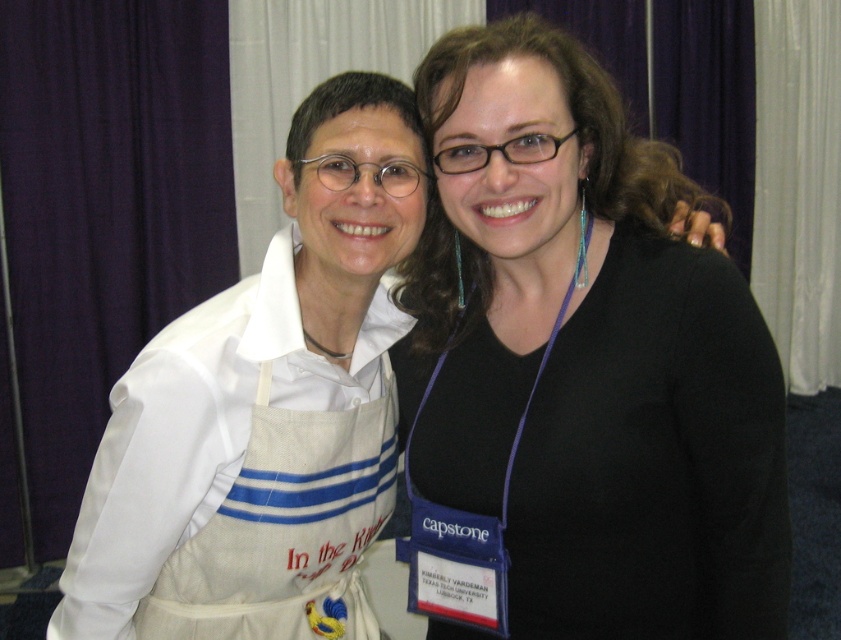
You are a photographer setting up a shot. You have two subjects in front of you. The first is wearing a black matte shirt at center, and the second is wearing a white fabric apron at left. You need to decide which subject to place closer to the camera to ensure their clothing items are clearly visible. Based on their clothing dimensions, which subject should you move closer?

The black matte shirt at center might be wider than white fabric apron at left, so to ensure clarity, move the subject in the white fabric apron at left closer to the camera since it is narrower and requires less space for clear visibility.

You are a photographer adjusting the camera settings for a group photo. You notice the black matte shirt at center and the whitecanvasapron at left in the frame. Which object should you focus on first if you want to ensure the taller object is in sharp focus?

The black matte shirt at center should be focused on first because it has a greater height compared to the whitecanvasapron at left, ensuring the taller object is in sharp focus.

You are a photographer trying to adjust the lighting for a photo shoot. You notice the black matte shirt at center and the white fabric apron at left. Which object should you focus the light on to ensure proper exposure, considering their positions and colors?

The black matte shirt at center should be focused on because it is positioned to the right of the white fabric apron at left and absorbs more light due to its dark color, requiring more illumination for balanced exposure.